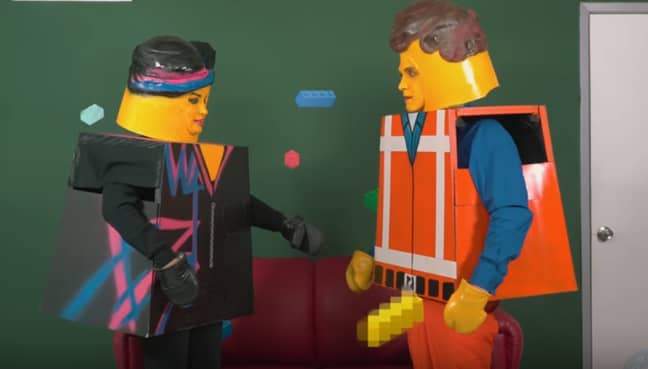
The width and height of the screenshot is (648, 369). Identify the location of wall. (314, 35).